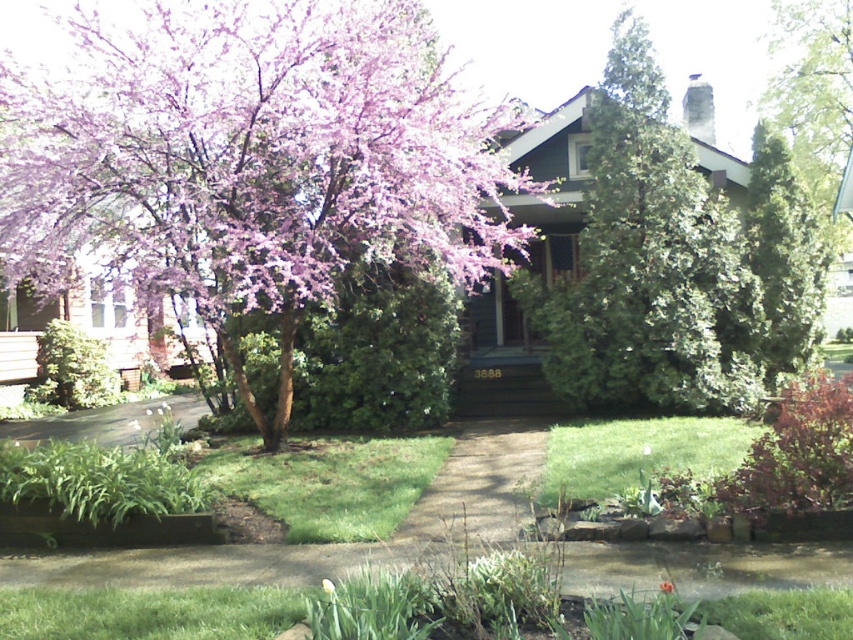
You are a gardener planning to water the green textured evergreen tree at right and the yellow matte flower at center. If your watering can holds enough water for 10 meters of travel, can you water both without refilling?

The distance between the green textured evergreen tree at right and the yellow matte flower at center is 11.04 meters. Since your watering can only allows for 10 meters of travel, you cannot water both without refilling.

You are standing in front of the suburban house and notice two points marked in the scene. The first point is at coordinates point (840, 129) and the second is at point (802, 304). Which point is closer to you?

Point (840, 129) is further to the viewer than point (802, 304), so the second point is closer to you.